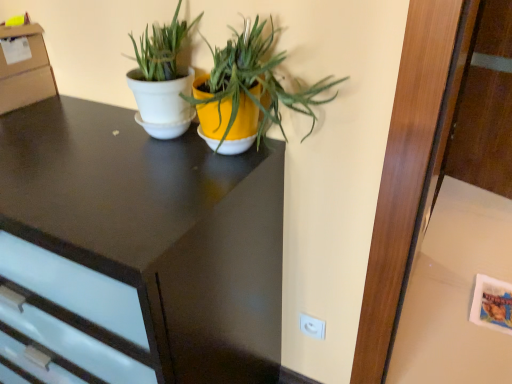
Where is `blank area beneath white glossy pot at center, which is the second houseplant in left-to-right order (from a real-world perspective)`? blank area beneath white glossy pot at center, which is the second houseplant in left-to-right order (from a real-world perspective) is located at coordinates (232, 153).